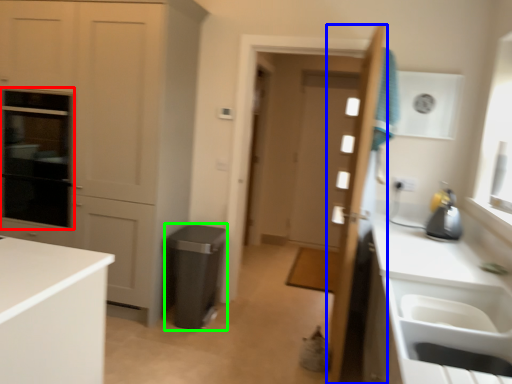
Question: Which is farther away from oven (highlighted by a red box)? door (highlighted by a blue box) or appliance (highlighted by a green box)?

Choices:
 (A) door
 (B) appliance

Answer: (A)